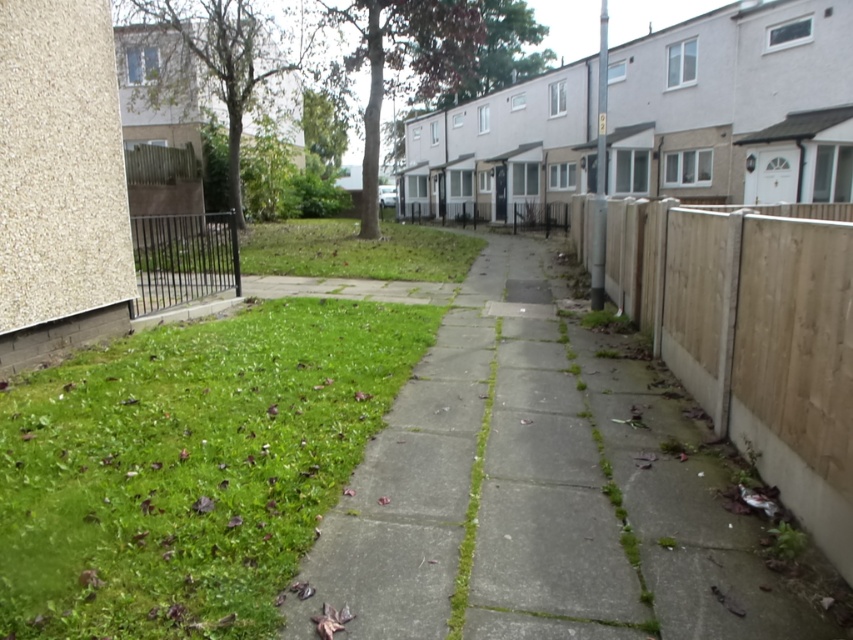
Between green grass at lower left and brown wooden fence at right, which one is positioned lower?

green grass at lower left is lower down.

Based on the photo, is green grass at lower left smaller than brown wooden fence at right?

Correct, green grass at lower left occupies less space than brown wooden fence at right.

At what (x,y) coordinates should I click in order to perform the action: click on green grass at lower left. Please return your answer as a coordinate pair (x, y). This screenshot has width=853, height=640. Looking at the image, I should click on pos(189,467).

At what (x,y) coordinates should I click in order to perform the action: click on brown wooden fence at right. Please return your answer as a coordinate pair (x, y). Looking at the image, I should click on (753, 336).

Between brown wooden fence at right and black metal fence at lower left, which one appears on the right side from the viewer's perspective?

Positioned to the right is brown wooden fence at right.

Find the location of a particular element. The width and height of the screenshot is (853, 640). brown wooden fence at right is located at coordinates (753, 336).

In order to click on brown wooden fence at right in this screenshot , I will do `click(753, 336)`.

Who is more forward, (x=1, y=428) or (x=189, y=244)?

Point (x=1, y=428) is more forward.

Which is behind, point (270, 408) or point (225, 216)?

Positioned behind is point (225, 216).

Which is in front, point (341, 481) or point (142, 220)?

Point (341, 481)

Find the location of `green grass at lower left`. green grass at lower left is located at coordinates (189, 467).